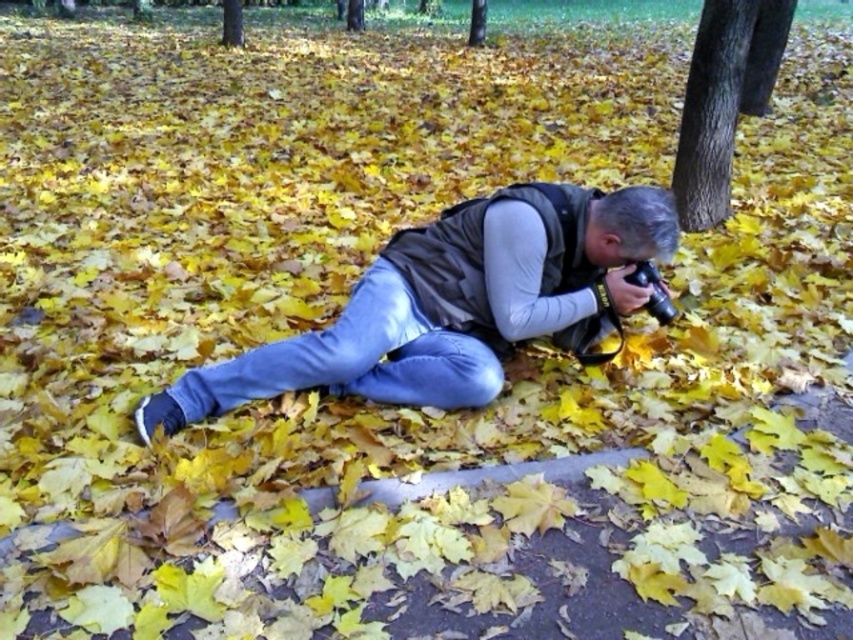
You are a photographer trying to capture both the smooth bark tree at center and the smooth bark tree at upper center in a single frame. Based on their sizes in the image, which tree should you focus on to ensure both are visible without moving your camera position?

The smooth bark tree at center is taller than the smooth bark tree at upper center, so focusing on the taller tree will help ensure both are visible in the frame.

You are a photographer planning to capture a wide shot of the denim jeans at center and the smooth bark tree at upper center in the park. Given that your camera can focus on objects within a 30 feet range, will both subjects be in focus?

The denim jeans at center and smooth bark tree at upper center are 28.41 feet apart, which is within the camera focus range of 30 feet. Therefore, both subjects will be in focus.

Looking at this image, you are a photographer aiming to capture a photo of both the smooth bark tree at center and the smooth bark tree at upper center. Which tree should you focus on first if you want to ensure both are in sharp focus?

You should focus on the smooth bark tree at center first because it is closer to the viewer than the smooth bark tree at upper center. By focusing on the closer tree, the farther tree will also be in focus due to the depth of field extending beyond the point of focus.